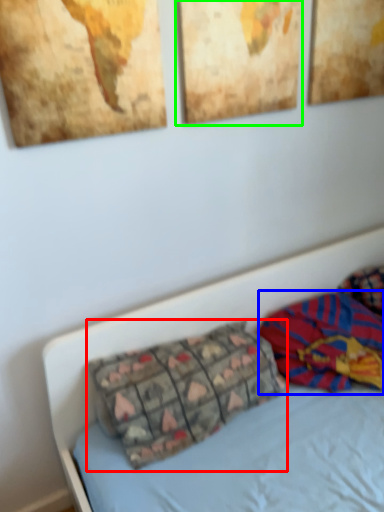
Question: Which is farther away from pillow (highlighted by a red box)? material (highlighted by a blue box) or picture frame (highlighted by a green box)?

Choices:
 (A) material
 (B) picture frame

Answer: (B)